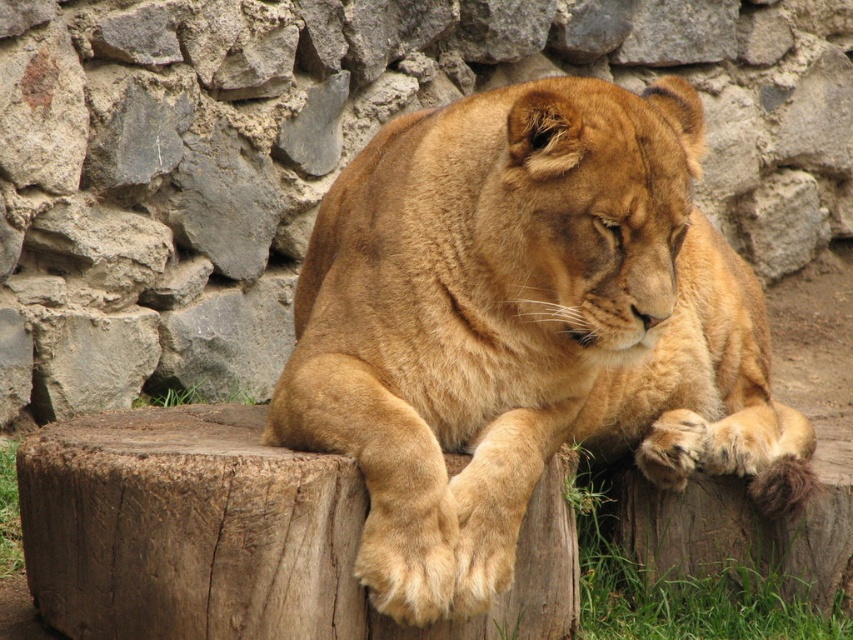
You are a zookeeper planning to place a new feeding station in the enclosure. The feeding station requires a space wider than the green grass at lower right. Can the golden fur lion at center provide enough space for this requirement?

The golden fur lion at center is wider than the green grass at lower right, so it can provide sufficient space for the feeding station that requires a width exceeding the green grass at lower right.

You are a zookeeper planning to place a water bowl for the lioness. The bowl needs to be equidistant from both the green grass at lower right and green grass at lower left. Where should you place it?

The water bowl should be placed exactly halfway between the green grass at lower right and green grass at lower left, which are 6.31 feet apart. This midpoint would ensure equal distance from both grass patches.